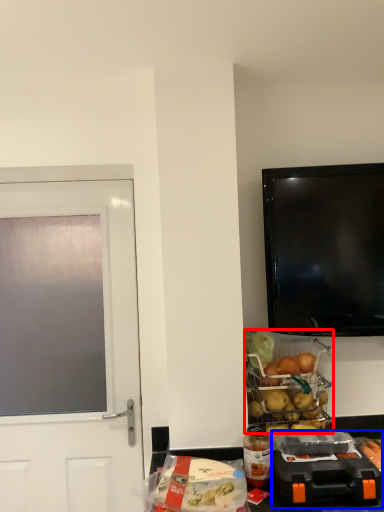
Question: Among these objects, which one is farthest to the camera, appliance (highlighted by a red box) or appliance (highlighted by a blue box)?

Choices:
 (A) appliance
 (B) appliance

Answer: (A)